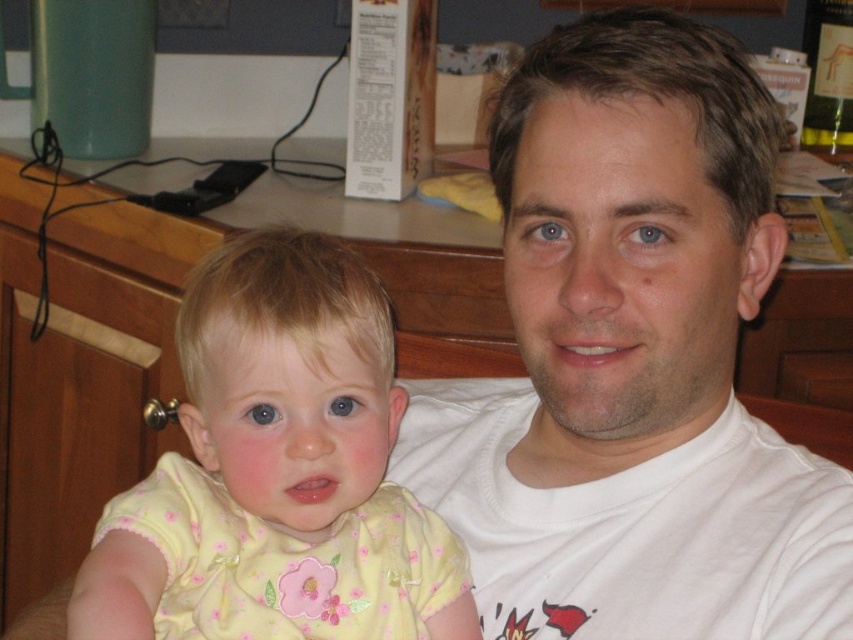
Question: Is white cotton shirt at center behind yellow fabric shirt at center?

Choices:
 (A) yes
 (B) no

Answer: (A)

Question: Which object is farther from the camera taking this photo?

Choices:
 (A) yellow fabric shirt at center
 (B) white cotton shirt at center

Answer: (B)

Question: Which point is closer to the camera taking this photo?

Choices:
 (A) (408, 595)
 (B) (515, 122)

Answer: (B)

Question: Does white cotton shirt at center have a smaller size compared to yellow fabric shirt at center?

Choices:
 (A) no
 (B) yes

Answer: (A)

Question: Does white cotton shirt at center appear under yellow fabric shirt at center?

Choices:
 (A) no
 (B) yes

Answer: (A)